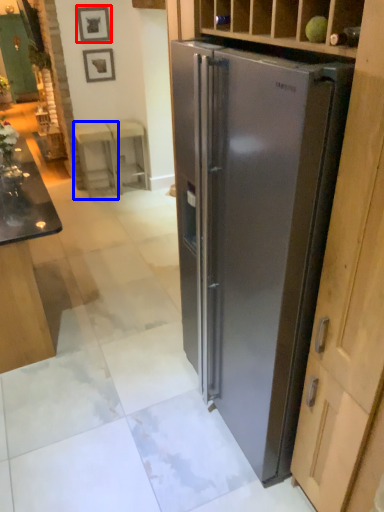
Question: Which object appears farthest to the camera in this image, picture frame (highlighted by a red box) or stool (highlighted by a blue box)?

Choices:
 (A) picture frame
 (B) stool

Answer: (B)